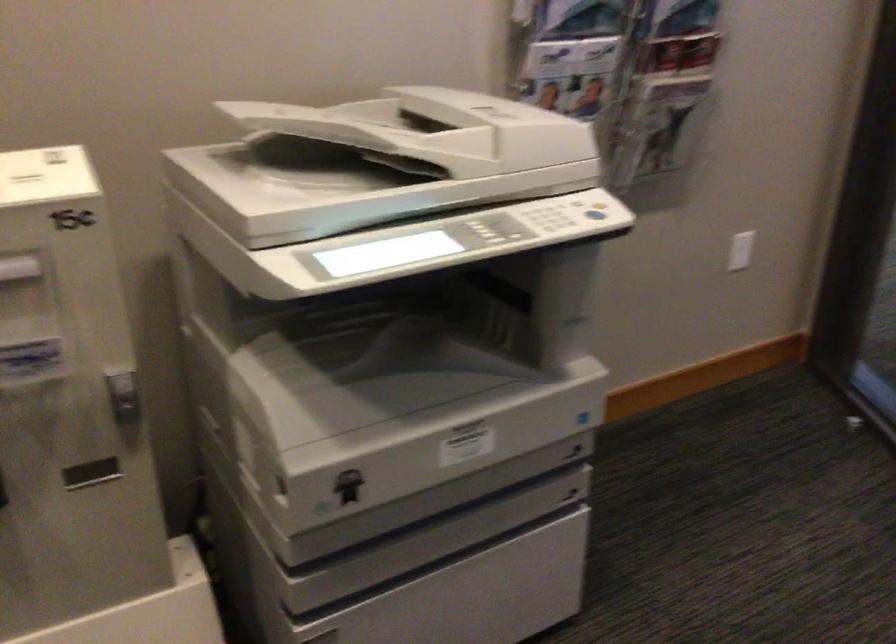
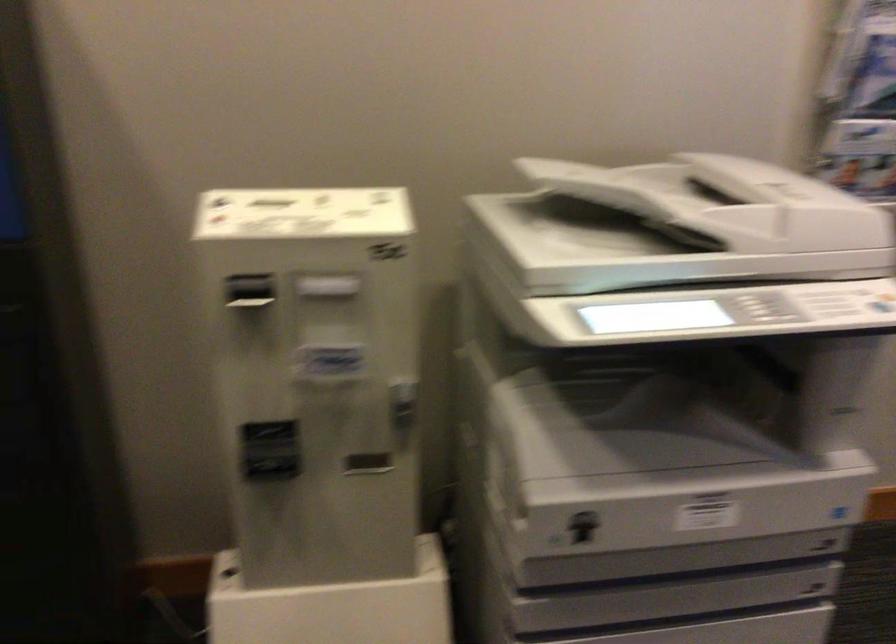
Question: Which direction would the cameraman need to move to produce the second image? Reply with the corresponding letter.

Choices:
 (A) Left
 (B) Right
 (C) Forward
 (D) Backward

Answer: (D)